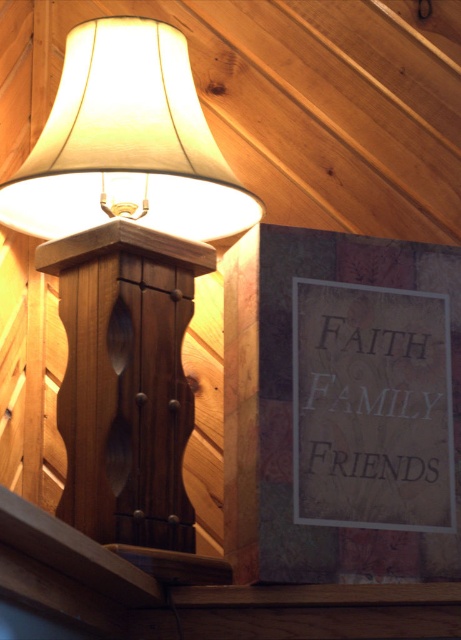
Question: Is wooden table lamp at upper left in front of wooden carved pillar at upper left?

Choices:
 (A) yes
 (B) no

Answer: (B)

Question: Where is wooden table lamp at upper left located in relation to wooden carved pillar at upper left in the image?

Choices:
 (A) left
 (B) right

Answer: (B)

Question: Which point is closer to the camera?

Choices:
 (A) (402, 356)
 (B) (161, 497)

Answer: (B)

Question: Among these objects, which one is farthest from the camera?

Choices:
 (A) wooden table lamp at upper left
 (B) wooden carved pillar at upper left

Answer: (A)

Question: Estimate the real-world distances between objects in this image. Which object is closer to the white paper sign at upper right?

Choices:
 (A) wooden table lamp at upper left
 (B) wooden carved pillar at upper left

Answer: (B)

Question: From the image, what is the correct spatial relationship of wooden table lamp at upper left in relation to white paper sign at upper right?

Choices:
 (A) above
 (B) below

Answer: (A)